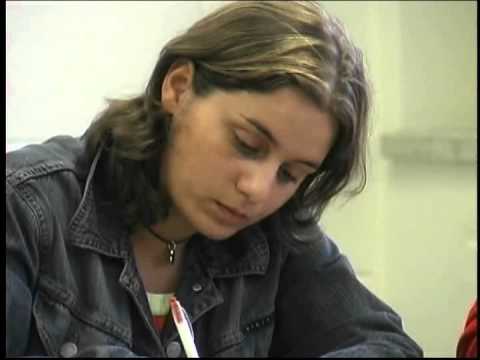
Find the location of a particular element. This screenshot has height=360, width=480. pen is located at coordinates click(187, 341).